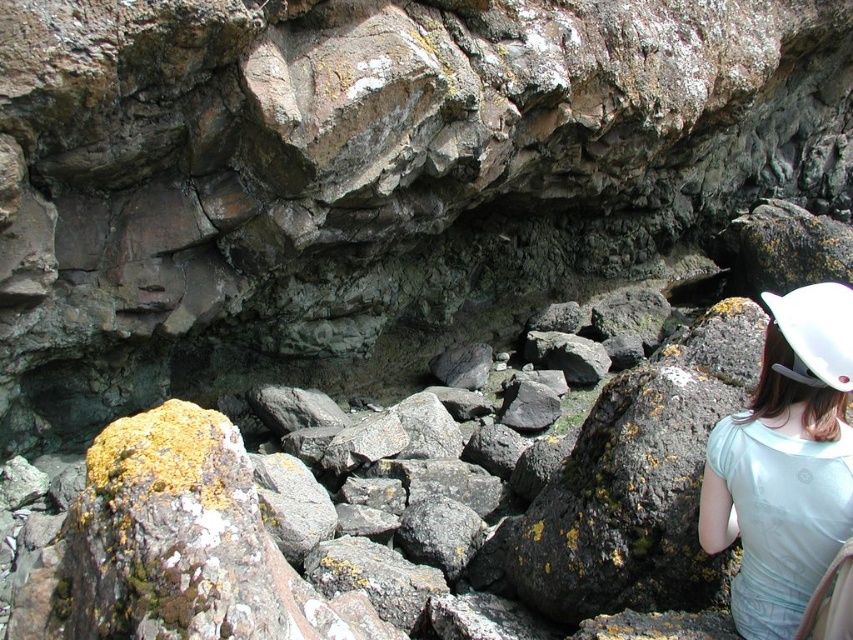
You are a hiker who has spotted two white hard hats in the rocky area. You need to retrieve the one closer to you. Which one should you choose between the white hard hat at center right and the white matte hard hat at right?

The white hard hat at center right is closer to you because it is in front of the white matte hard hat at right.

You are a construction worker who needs to place a tool that is 12 inches long between the white hard hat at center right and the white matte hard hat at right. Can you fit the tool horizontally between them without moving either hard hat?

The distance between the white hard hat at center right and the white matte hard hat at right is 12.78 inches, which is slightly more than the tool length of 12 inches. Therefore, the tool can be placed horizontally between them without moving either hard hat.

You are standing in a rocky area and see two points marked on the ground. The first point is at coordinate point (793, 448) and the second is at point (816, 360). If you want to move closer to the cliff face in the background, which point should you walk towards?

You should walk towards point (816, 360) because point (793, 448) is closer to you, meaning point (816, 360) is further away and closer to the cliff face in the background.